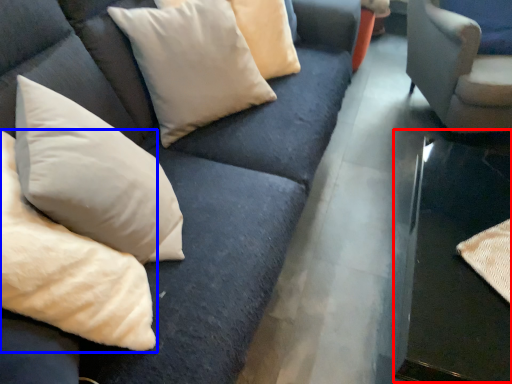
Question: Which point is closer to the camera, table (highlighted by a red box) or pillow (highlighted by a blue box)?

Choices:
 (A) table
 (B) pillow

Answer: (B)